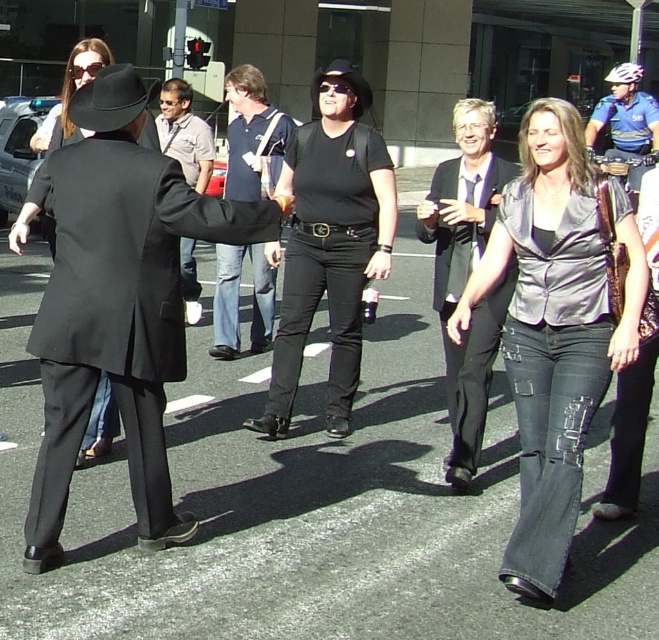
Which is behind, point (563, 435) or point (92, 92)?

Point (92, 92)

The width and height of the screenshot is (659, 640). I want to click on metallic gray shirt at center, so click(556, 326).

Where is `metallic gray shirt at center`? metallic gray shirt at center is located at coordinates (556, 326).

Is matte black suit at left below light brown shirt at center?

Correct, matte black suit at left is located below light brown shirt at center.

You are a GUI agent. You are given a task and a screenshot of the screen. Output one action in this format:
    pyautogui.click(x=<x>, y=<y>)
    Task: Click on the matte black suit at left
    
    Given the screenshot: What is the action you would take?
    pyautogui.click(x=119, y=320)

Between metallic gray shirt at center and blue uniform helmet at upper right, which one appears on the left side from the viewer's perspective?

Positioned to the left is metallic gray shirt at center.

Can you confirm if metallic gray shirt at center is positioned above blue uniform helmet at upper right?

Actually, metallic gray shirt at center is below blue uniform helmet at upper right.

Between point (511, 563) and point (645, 97), which one is positioned in front?

Point (511, 563)

Where is `metallic gray shirt at center`? This screenshot has width=659, height=640. metallic gray shirt at center is located at coordinates (556, 326).